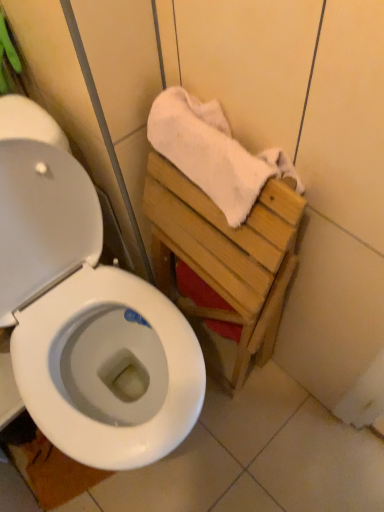
Image resolution: width=384 pixels, height=512 pixels. I want to click on vacant area situated below white glossy toilet seat at lower left (from a real-world perspective), so click(x=60, y=474).